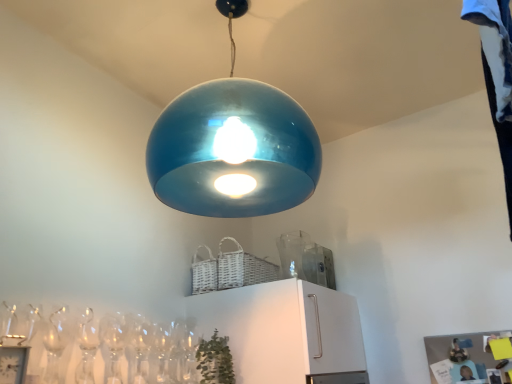
Question: Are transparent glass vase at upper center and green matte plant at lower center making contact?

Choices:
 (A) no
 (B) yes

Answer: (A)

Question: Can we say transparent glass vase at upper center lies outside green matte plant at lower center?

Choices:
 (A) yes
 (B) no

Answer: (A)

Question: Is transparent glass vase at upper center bigger than green matte plant at lower center?

Choices:
 (A) yes
 (B) no

Answer: (B)

Question: Does transparent glass vase at upper center have a greater height compared to green matte plant at lower center?

Choices:
 (A) no
 (B) yes

Answer: (B)

Question: Does transparent glass vase at upper center come behind green matte plant at lower center?

Choices:
 (A) no
 (B) yes

Answer: (B)

Question: From the image's perspective, is transparent glass vase at upper center above green matte plant at lower center?

Choices:
 (A) no
 (B) yes

Answer: (B)

Question: Does glossy blue pendant light at center have a larger size compared to green matte plant at lower center?

Choices:
 (A) no
 (B) yes

Answer: (B)

Question: Can you confirm if glossy blue pendant light at center is taller than green matte plant at lower center?

Choices:
 (A) no
 (B) yes

Answer: (B)

Question: Is there a large distance between glossy blue pendant light at center and green matte plant at lower center?

Choices:
 (A) yes
 (B) no

Answer: (B)

Question: Is glossy blue pendant light at center oriented away from green matte plant at lower center?

Choices:
 (A) no
 (B) yes

Answer: (A)

Question: From a real-world perspective, is glossy blue pendant light at center positioned under green matte plant at lower center based on gravity?

Choices:
 (A) no
 (B) yes

Answer: (A)

Question: Is glossy blue pendant light at center behind green matte plant at lower center?

Choices:
 (A) yes
 (B) no

Answer: (B)

Question: From a real-world perspective, is transparent glass vase at upper center positioned under glossy blue pendant light at center based on gravity?

Choices:
 (A) yes
 (B) no

Answer: (A)